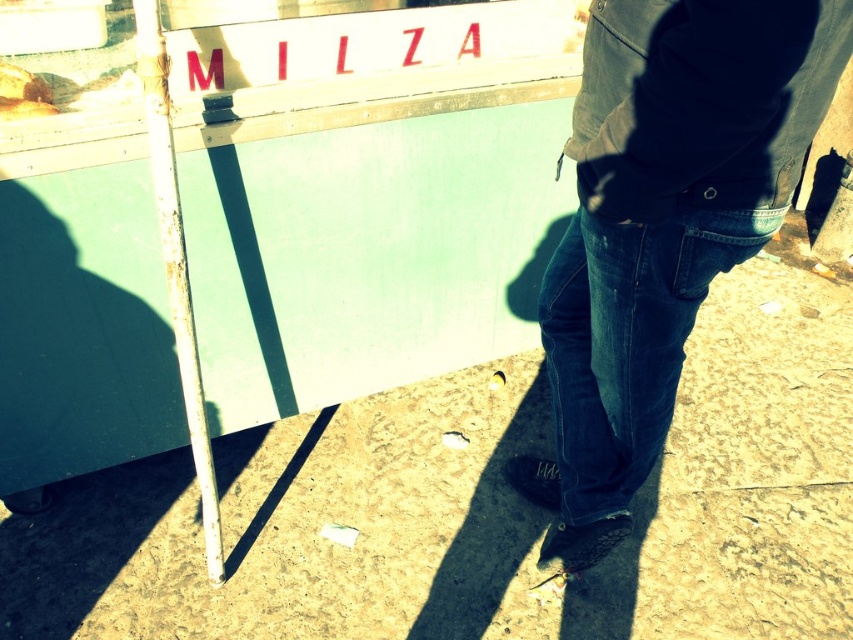
Find the location of `dark blue jeans at lower right`. dark blue jeans at lower right is located at coordinates click(662, 225).

At what (x,y) coordinates should I click in order to perform the action: click on dark blue jeans at lower right. Please return your answer as a coordinate pair (x, y). The image size is (853, 640). Looking at the image, I should click on (662, 225).

How much distance is there between brown textured pavement at lower center and denim at right?

brown textured pavement at lower center and denim at right are 27.59 inches apart.

Does point (606, 637) come in front of point (596, 323)?

That is False.

At what (x,y) coordinates should I click in order to perform the action: click on brown textured pavement at lower center. Please return your answer as a coordinate pair (x, y). The height and width of the screenshot is (640, 853). Looking at the image, I should click on (485, 508).

Is point (654, 634) less distant than point (749, 129)?

No, (654, 634) is behind (749, 129).

Describe the element at coordinates (485, 508) in the screenshot. The height and width of the screenshot is (640, 853). I see `brown textured pavement at lower center` at that location.

The height and width of the screenshot is (640, 853). I want to click on brown textured pavement at lower center, so click(485, 508).